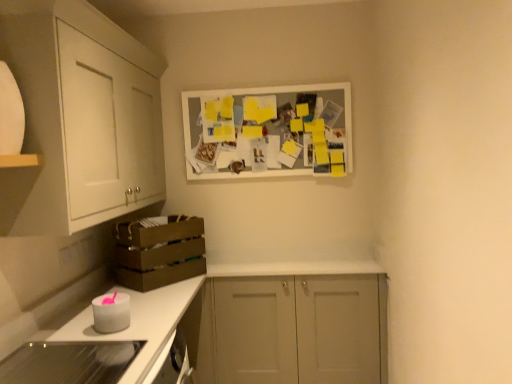
Question: Is white matte picture frame at upper center bigger than glassy white stove at lower left, the second appliance viewed from the back?

Choices:
 (A) yes
 (B) no

Answer: (A)

Question: Is white matte picture frame at upper center positioned with its back to glassy white stove at lower left, the second appliance viewed from the back?

Choices:
 (A) yes
 (B) no

Answer: (B)

Question: Does white matte picture frame at upper center have a greater width compared to glassy white stove at lower left, which ranks as the 2th appliance in top-to-bottom order?

Choices:
 (A) no
 (B) yes

Answer: (A)

Question: Does white matte picture frame at upper center appear on the right side of glassy white stove at lower left, which ranks as the 2th appliance in top-to-bottom order?

Choices:
 (A) yes
 (B) no

Answer: (A)

Question: Can you confirm if white matte picture frame at upper center is thinner than glassy white stove at lower left, which ranks as the 2th appliance in top-to-bottom order?

Choices:
 (A) no
 (B) yes

Answer: (B)

Question: Visually, is white matte cabinet at center, which is the first cabinetry in bottom-to-top order, positioned to the left or to the right of white matte cabinet at upper left, which is the second cabinetry in bottom-to-top order?

Choices:
 (A) left
 (B) right

Answer: (B)

Question: From the image's perspective, is white matte cabinet at center, the 2th cabinetry from the top, located above or below white matte cabinet at upper left, the first cabinetry viewed from the top?

Choices:
 (A) above
 (B) below

Answer: (B)

Question: Is point (238, 357) positioned closer to the camera than point (131, 112)?

Choices:
 (A) farther
 (B) closer

Answer: (A)

Question: From a real-world perspective, is white matte cabinet at center, which is the first cabinetry in bottom-to-top order, physically located above or below white matte cabinet at upper left, the first cabinetry from the left?

Choices:
 (A) below
 (B) above

Answer: (A)

Question: From the image's perspective, is white glossy countertop at lower left located above or below white matte candle at lower left, the 1th appliance in the back-to-front sequence?

Choices:
 (A) above
 (B) below

Answer: (B)

Question: From a real-world perspective, is white glossy countertop at lower left positioned above or below white matte candle at lower left, the 1th appliance in the back-to-front sequence?

Choices:
 (A) above
 (B) below

Answer: (B)

Question: Visually, is white glossy countertop at lower left positioned to the left or to the right of white matte candle at lower left, which is the second appliance in front-to-back order?

Choices:
 (A) right
 (B) left

Answer: (A)

Question: From their relative heights in the image, would you say white glossy countertop at lower left is taller or shorter than white matte candle at lower left, positioned as the second appliance in bottom-to-top order?

Choices:
 (A) short
 (B) tall

Answer: (B)

Question: Is brown cardboard crate at lower left in front of or behind white matte candle at lower left, the 1th appliance in the back-to-front sequence, in the image?

Choices:
 (A) front
 (B) behind

Answer: (B)

Question: Considering the positions of brown cardboard crate at lower left and white matte candle at lower left, positioned as the second appliance in bottom-to-top order, in the image, is brown cardboard crate at lower left wider or thinner than white matte candle at lower left, positioned as the second appliance in bottom-to-top order,?

Choices:
 (A) thin
 (B) wide

Answer: (B)